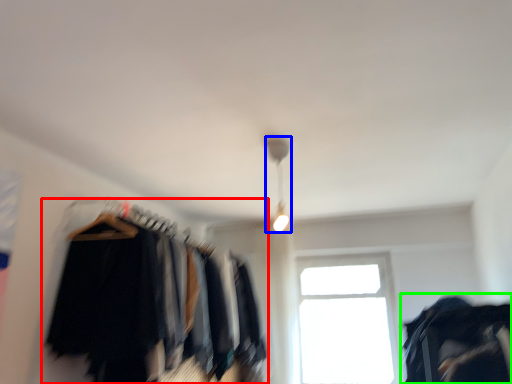
Question: Based on their relative distances, which object is nearer to closet (highlighted by a red box)? Choose from lamp (highlighted by a blue box) and clothing (highlighted by a green box).

Choices:
 (A) lamp
 (B) clothing

Answer: (A)